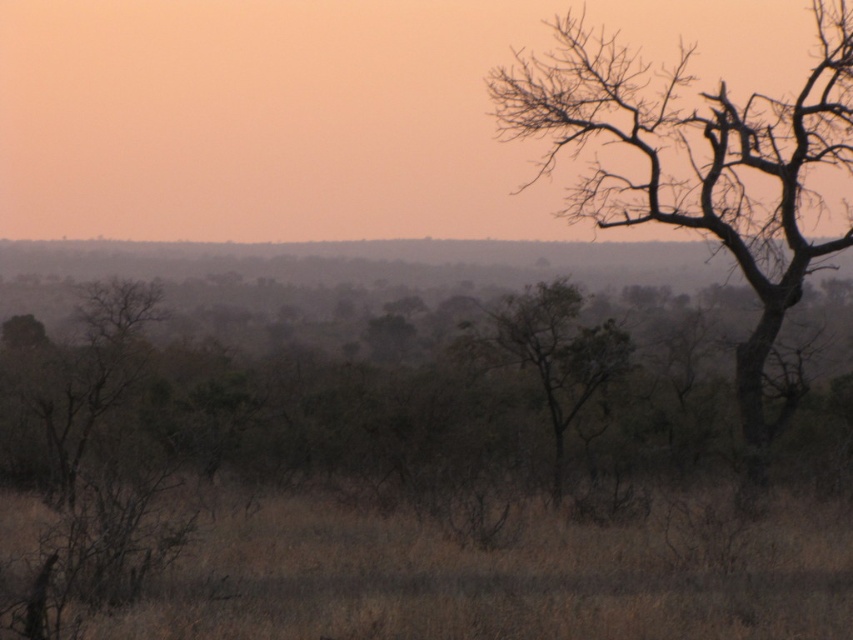
You are standing at the point marked as point [502,577] in the image. Based on the scene description, what type of terrain are you currently standing on?

The point [502,577] is on brown dry grass at lower center, so you are standing on dry grass terrain.

You are standing at the point marked as point [502,577]. What object is located exactly at that point?

The brown dry grass at lower center is located at point [502,577].